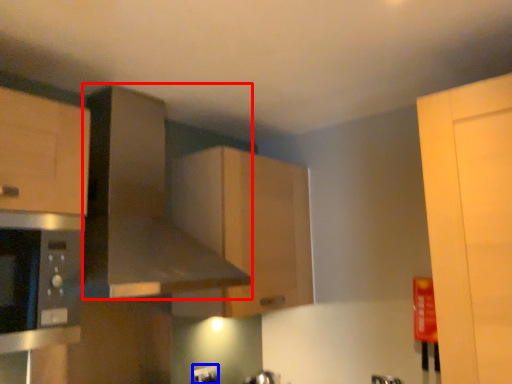
Question: Among these objects, which one is farthest to the camera, exhaust hood (highlighted by a red box) or electric outlet (highlighted by a blue box)?

Choices:
 (A) exhaust hood
 (B) electric outlet

Answer: (B)